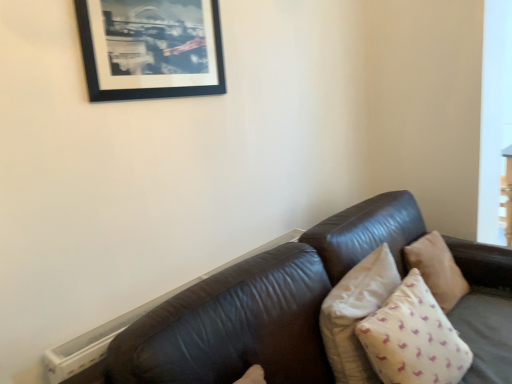
This screenshot has width=512, height=384. I want to click on beige fabric pillow at right, the 2th pillow from the front, so click(356, 314).

This screenshot has width=512, height=384. What do you see at coordinates (356, 314) in the screenshot?
I see `beige fabric pillow at right, arranged as the 2th pillow when viewed from the back` at bounding box center [356, 314].

Describe the element at coordinates (437, 269) in the screenshot. I see `beige fabric pillow at right, which is counted as the 1th pillow, starting from the back` at that location.

You are a GUI agent. You are given a task and a screenshot of the screen. Output one action in this format:
    pyautogui.click(x=<x>, y=<y>)
    Task: Click on the black matte picture frame at upper left
    The height and width of the screenshot is (384, 512).
    Given the screenshot: What is the action you would take?
    pyautogui.click(x=150, y=48)

Does beige fabric pillow at right, arranged as the 2th pillow when viewed from the back, appear on the right side of black matte picture frame at upper left?

Correct, you'll find beige fabric pillow at right, arranged as the 2th pillow when viewed from the back, to the right of black matte picture frame at upper left.

Considering the relative sizes of beige fabric pillow at right, the 2th pillow from the front, and black matte picture frame at upper left in the image provided, is beige fabric pillow at right, the 2th pillow from the front, wider than black matte picture frame at upper left?

Yes.

Could you tell me if beige fabric pillow at right, the 2th pillow from the front, is turned towards black matte picture frame at upper left?

No, beige fabric pillow at right, the 2th pillow from the front, does not turn towards black matte picture frame at upper left.

Is beige fabric pillow at right, the 2th pillow from the front, far from black matte picture frame at upper left?

Indeed, beige fabric pillow at right, the 2th pillow from the front, is not near black matte picture frame at upper left.

Measure the distance between beige cotton pillow at lower right, which is the third pillow from back to front, and beige fabric pillow at right, which is counted as the 1th pillow, starting from the back.

18.14 inches.

Can you confirm if beige cotton pillow at lower right, which is the third pillow from back to front, is smaller than beige fabric pillow at right, which is counted as the 1th pillow, starting from the back?

Incorrect, beige cotton pillow at lower right, which is the third pillow from back to front, is not smaller in size than beige fabric pillow at right, which is counted as the 1th pillow, starting from the back.

From the image's perspective, is beige cotton pillow at lower right, which is the third pillow from back to front, on top of beige fabric pillow at right, which is the 3th pillow in front-to-back order?

No.

Is beige cotton pillow at lower right, which is the third pillow from back to front, next to black matte picture frame at upper left?

No, beige cotton pillow at lower right, which is the third pillow from back to front, is not next to black matte picture frame at upper left.

At what (x,y) coordinates should I click in order to perform the action: click on the 2nd pillow below the black matte picture frame at upper left (from a real-world perspective). Please return your answer as a coordinate pair (x, y). Looking at the image, I should click on pos(413,338).

From the image's perspective, relative to black matte picture frame at upper left, is beige cotton pillow at lower right, which is the third pillow from back to front, above or below?

From the image's perspective, beige cotton pillow at lower right, which is the third pillow from back to front, appears below black matte picture frame at upper left.

Based on the photo, is the depth of beige cotton pillow at lower right, which is the third pillow from back to front, less than that of black matte picture frame at upper left?

Yes.

Which is nearer, (357, 346) or (455, 286)?

Point (357, 346) appears to be closer to the viewer than point (455, 286).

Which is correct: beige fabric pillow at right, the 2th pillow from the front, is inside beige fabric pillow at right, which is the 3th pillow in front-to-back order, or outside of it?

beige fabric pillow at right, the 2th pillow from the front, is not inside beige fabric pillow at right, which is the 3th pillow in front-to-back order, it's outside.

Between beige fabric pillow at right, the 2th pillow from the front, and beige fabric pillow at right, which is counted as the 1th pillow, starting from the back, which one is positioned behind?

Positioned behind is beige fabric pillow at right, which is counted as the 1th pillow, starting from the back.

From their relative heights in the image, would you say black matte picture frame at upper left is taller or shorter than beige fabric pillow at right, which is counted as the 1th pillow, starting from the back?

black matte picture frame at upper left is shorter than beige fabric pillow at right, which is counted as the 1th pillow, starting from the back.

Can you confirm if black matte picture frame at upper left is thinner than beige fabric pillow at right, which is counted as the 1th pillow, starting from the back?

Yes.

From a real-world perspective, is black matte picture frame at upper left under beige fabric pillow at right, which is the 3th pillow in front-to-back order?

No, from a real-world perspective, black matte picture frame at upper left is not under beige fabric pillow at right, which is the 3th pillow in front-to-back order.

Considering the positions of objects black matte picture frame at upper left and beige fabric pillow at right, which is the 3th pillow in front-to-back order, in the image provided, who is behind, black matte picture frame at upper left or beige fabric pillow at right, which is the 3th pillow in front-to-back order,?

beige fabric pillow at right, which is the 3th pillow in front-to-back order, is more distant.

From the picture: Which is in front, beige fabric pillow at right, which is counted as the 1th pillow, starting from the back, or black matte picture frame at upper left?

black matte picture frame at upper left is closer to the camera.

From the image's perspective, which one is positioned lower, beige fabric pillow at right, which is counted as the 1th pillow, starting from the back, or black matte picture frame at upper left?

beige fabric pillow at right, which is counted as the 1th pillow, starting from the back, is shown below in the image.

Can you confirm if beige fabric pillow at right, which is the 3th pillow in front-to-back order, is positioned to the right of black matte picture frame at upper left?

Yes, beige fabric pillow at right, which is the 3th pillow in front-to-back order, is to the right of black matte picture frame at upper left.

Locate an element on the screen. This screenshot has width=512, height=384. picture frame above the beige fabric pillow at right, which is counted as the 1th pillow, starting from the back (from the image's perspective) is located at coordinates (150, 48).

Does black matte picture frame at upper left lie in front of beige cotton pillow at lower right, which is the third pillow from back to front?

No, it is not.

Does black matte picture frame at upper left turn towards beige cotton pillow at lower right, the first pillow viewed from the front?

No, black matte picture frame at upper left is not oriented towards beige cotton pillow at lower right, the first pillow viewed from the front.

From a real-world perspective, is black matte picture frame at upper left located beneath beige cotton pillow at lower right, the first pillow viewed from the front?

No, from a real-world perspective, black matte picture frame at upper left is not under beige cotton pillow at lower right, the first pillow viewed from the front.

Looking at this image, is black matte picture frame at upper left to the left of beige cotton pillow at lower right, which is the third pillow from back to front, from the viewer's perspective?

Yes.

There is a black matte picture frame at upper left. Where is `the 2nd pillow below it (from the image's perspective)`? The image size is (512, 384). the 2nd pillow below it (from the image's perspective) is located at coordinates (356, 314).

Identify the location of pillow that is the 2nd one when counting forward from the beige fabric pillow at right, which is the 3th pillow in front-to-back order. (413, 338).

Which object lies further to the anchor point beige fabric pillow at right, arranged as the 2th pillow when viewed from the back, black matte picture frame at upper left or beige fabric pillow at right, which is counted as the 1th pillow, starting from the back?

black matte picture frame at upper left is positioned further to the anchor beige fabric pillow at right, arranged as the 2th pillow when viewed from the back.

When comparing their distances from beige fabric pillow at right, which is counted as the 1th pillow, starting from the back, does black matte picture frame at upper left or beige cotton pillow at lower right, which is the third pillow from back to front, seem closer?

beige cotton pillow at lower right, which is the third pillow from back to front, lies closer to beige fabric pillow at right, which is counted as the 1th pillow, starting from the back, than the other object.

Considering their positions, is beige fabric pillow at right, which is counted as the 1th pillow, starting from the back, positioned closer to beige cotton pillow at lower right, the first pillow viewed from the front, than beige fabric pillow at right, arranged as the 2th pillow when viewed from the back?

beige fabric pillow at right, arranged as the 2th pillow when viewed from the back, is positioned closer to the anchor beige cotton pillow at lower right, the first pillow viewed from the front.

Based on their spatial positions, is black matte picture frame at upper left or beige fabric pillow at right, arranged as the 2th pillow when viewed from the back, closer to beige cotton pillow at lower right, the first pillow viewed from the front?

The object closer to beige cotton pillow at lower right, the first pillow viewed from the front, is beige fabric pillow at right, arranged as the 2th pillow when viewed from the back.

When comparing their distances from beige cotton pillow at lower right, which is the third pillow from back to front, does beige fabric pillow at right, arranged as the 2th pillow when viewed from the back, or beige fabric pillow at right, which is counted as the 1th pillow, starting from the back, seem closer?

beige fabric pillow at right, arranged as the 2th pillow when viewed from the back, lies closer to beige cotton pillow at lower right, which is the third pillow from back to front, than the other object.

Considering their positions, is beige fabric pillow at right, the 2th pillow from the front, positioned further to beige cotton pillow at lower right, which is the third pillow from back to front, than black matte picture frame at upper left?

black matte picture frame at upper left.

Estimate the real-world distances between objects in this image. Which object is closer to beige fabric pillow at right, which is counted as the 1th pillow, starting from the back, black matte picture frame at upper left or beige fabric pillow at right, arranged as the 2th pillow when viewed from the back?

beige fabric pillow at right, arranged as the 2th pillow when viewed from the back, is closer to beige fabric pillow at right, which is counted as the 1th pillow, starting from the back.

Which object lies nearer to the anchor point black matte picture frame at upper left, beige cotton pillow at lower right, which is the third pillow from back to front, or beige fabric pillow at right, which is the 3th pillow in front-to-back order?

Based on the image, beige cotton pillow at lower right, which is the third pillow from back to front, appears to be nearer to black matte picture frame at upper left.

What are the coordinates of `pillow positioned between beige cotton pillow at lower right, the first pillow viewed from the front, and beige fabric pillow at right, which is the 3th pillow in front-to-back order, from near to far` in the screenshot? It's located at (356, 314).